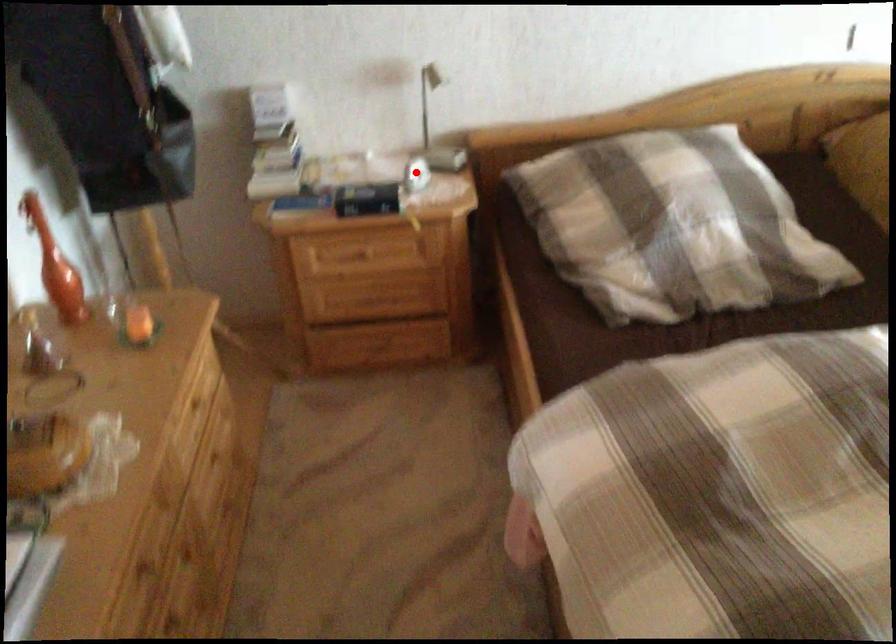
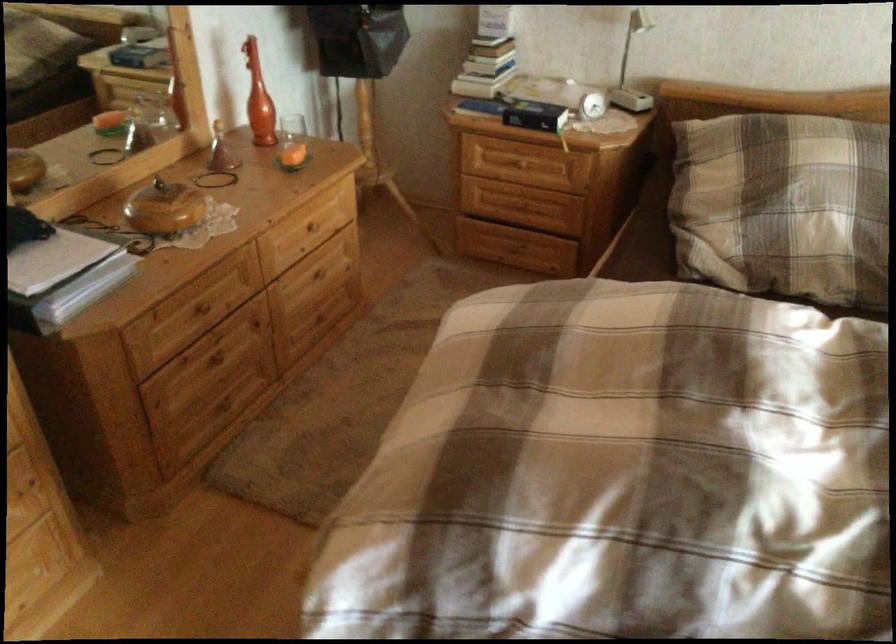
In the second image, find the point that corresponds to the highlighted location in the first image.

(587, 100)